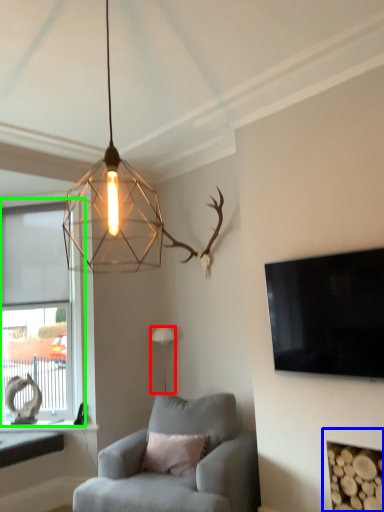
Question: Which object is the closest to the lamp (highlighted by a red box)? Choose among these: fireplace (highlighted by a blue box) or window (highlighted by a green box).

Choices:
 (A) fireplace
 (B) window

Answer: (B)